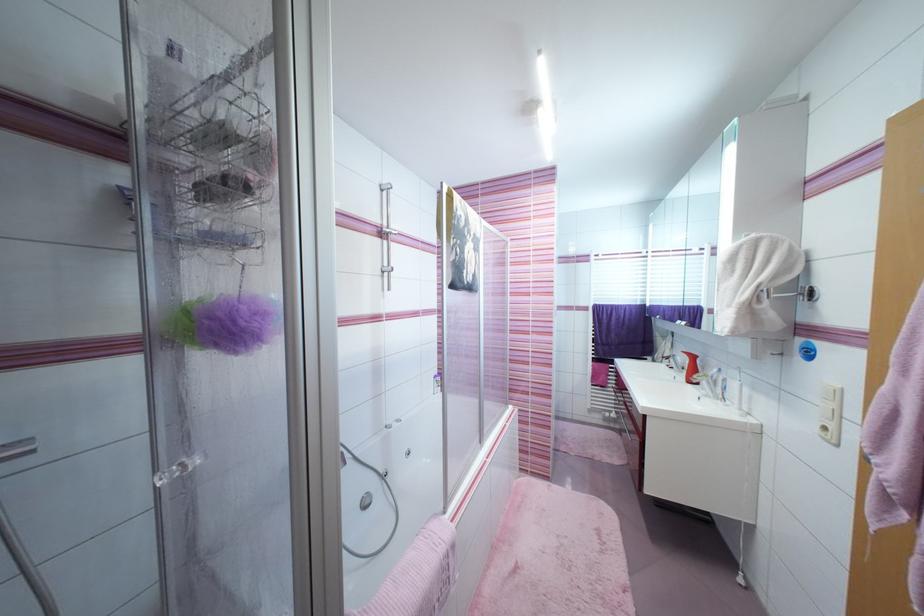
Where is `bathtub screen handle`? This screenshot has height=616, width=924. bathtub screen handle is located at coordinates (373, 505).